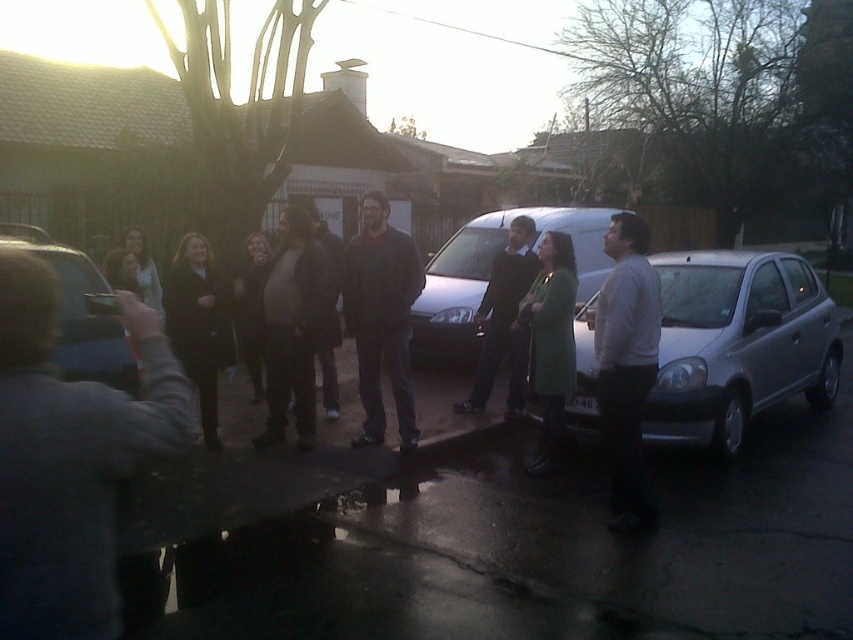
You are a delivery person trying to park your van in the driveway. There is a satin silver car at right at point (737, 342). Can you park your van here without blocking the car?

The satin silver car at right is located at point (737, 342). Since the driveway has enough space for parking, you can park your van here without blocking the car.